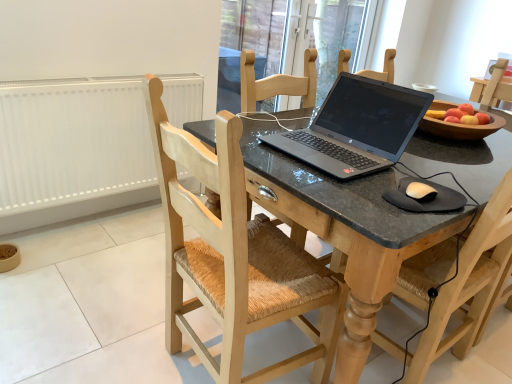
You are a GUI agent. You are given a task and a screenshot of the screen. Output one action in this format:
    pyautogui.click(x=<x>, y=<y>)
    Task: Click on the free point below black rubber mousepad at lower right (from a real-world perspective)
    This screenshot has width=512, height=384.
    Given the screenshot: What is the action you would take?
    pyautogui.click(x=426, y=204)